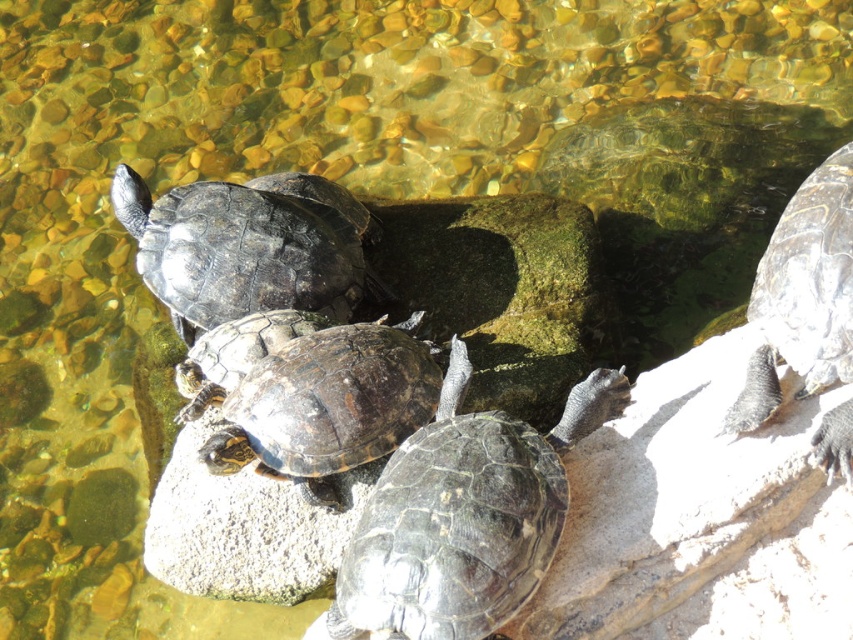
Between shiny dark gray tortoise at center and shiny brown tortoise at center, which one is positioned higher?

shiny dark gray tortoise at center is above.

Does point (340, 243) come farther from viewer compared to point (247, 337)?

Yes, point (340, 243) is farther from viewer.

Who is more forward, (230,320) or (190,381)?

Point (190,381) is in front.

Locate an element on the screen. This screenshot has width=853, height=640. shiny dark gray tortoise at center is located at coordinates (248, 246).

Can you confirm if shiny dark green tortoise at center is positioned below shiny dark green tortoise at right?

Yes, shiny dark green tortoise at center is below shiny dark green tortoise at right.

Can you confirm if shiny dark green tortoise at center is shorter than shiny dark green tortoise at right?

Yes, shiny dark green tortoise at center is shorter than shiny dark green tortoise at right.

The image size is (853, 640). What are the coordinates of `shiny dark green tortoise at center` in the screenshot? It's located at (463, 516).

Does point (315, 381) lie behind point (764, 376)?

Yes, point (315, 381) is behind point (764, 376).

Is shiny dark brown tortoise at center to the right of shiny dark green tortoise at right from the viewer's perspective?

In fact, shiny dark brown tortoise at center is to the left of shiny dark green tortoise at right.

The image size is (853, 640). I want to click on shiny dark brown tortoise at center, so click(x=325, y=404).